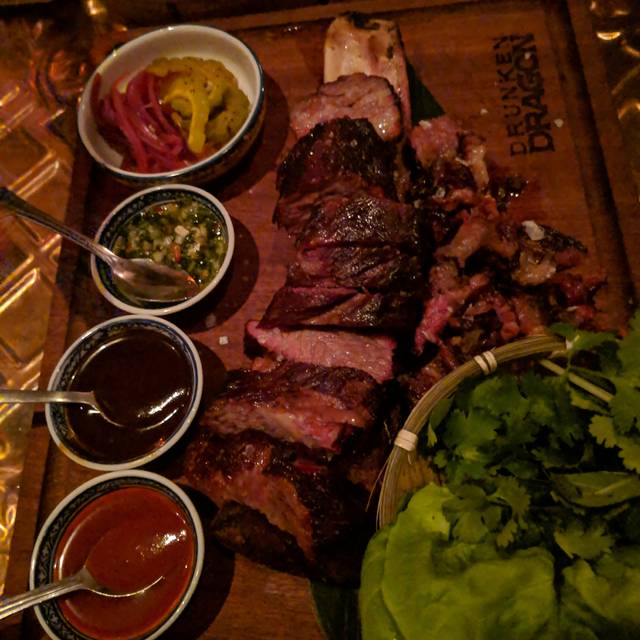
Where is `cutting board`? The image size is (640, 640). cutting board is located at coordinates (591, 196).